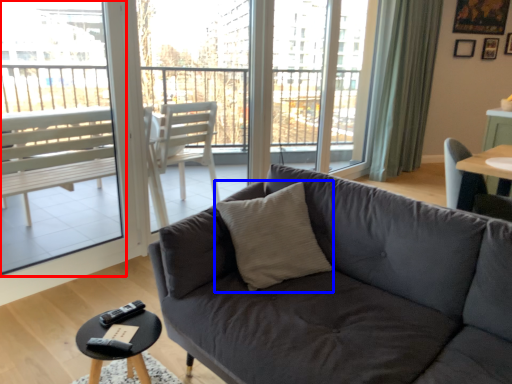
Question: Which object appears closest to the camera in this image, window screen (highlighted by a red box) or throw pillow (highlighted by a blue box)?

Choices:
 (A) window screen
 (B) throw pillow

Answer: (B)